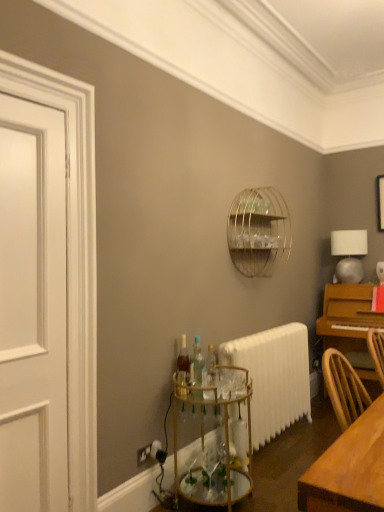
Describe the element at coordinates (183, 360) in the screenshot. The height and width of the screenshot is (512, 384). I see `translucent glass bottle at center, which is the first bottle from back to front` at that location.

This screenshot has width=384, height=512. I want to click on translucent glass bottle at center, the 2th bottle in the front-to-back sequence, so click(183, 360).

I want to click on white painted radiator at lower center, so click(x=273, y=377).

The width and height of the screenshot is (384, 512). Describe the element at coordinates (197, 362) in the screenshot. I see `clear glass bottles at center, acting as the 2th bottle starting from the back` at that location.

Locate an element on the screen. This screenshot has width=384, height=512. light brown wooden table at lower right is located at coordinates click(x=349, y=469).

From the image's perspective, which one is positioned lower, white painted wood door at left or white painted radiator at lower center?

white painted radiator at lower center.

Is white painted radiator at lower center at the back of white painted wood door at left?

No, white painted radiator at lower center is not at the back of white painted wood door at left.

From the picture: Is white painted wood door at left to the left of white painted radiator at lower center from the viewer's perspective?

Correct, you'll find white painted wood door at left to the left of white painted radiator at lower center.

Could you tell me if white painted radiator at lower center is facing clear glass bottles at center, which is the first bottle from front to back?

No, white painted radiator at lower center is not facing towards clear glass bottles at center, which is the first bottle from front to back.

Does white painted radiator at lower center lie behind clear glass bottles at center, acting as the 2th bottle starting from the back?

Yes, white painted radiator at lower center is further from the camera.

What's the angular difference between white painted radiator at lower center and clear glass bottles at center, acting as the 2th bottle starting from the back,'s facing directions?

21.3 degrees.

Considering the relative sizes of white painted radiator at lower center and clear glass bottles at center, acting as the 2th bottle starting from the back, in the image provided, is white painted radiator at lower center bigger than clear glass bottles at center, acting as the 2th bottle starting from the back,?

Yes, white painted radiator at lower center is bigger than clear glass bottles at center, acting as the 2th bottle starting from the back.

Consider the image. Which of these two, white matte table lamp at upper right or light brown wooden table at lower right, is wider?

Wider between the two is light brown wooden table at lower right.

Considering the sizes of objects white matte table lamp at upper right and light brown wooden table at lower right in the image provided, who is shorter, white matte table lamp at upper right or light brown wooden table at lower right?

With less height is light brown wooden table at lower right.

Is point (358, 281) positioned in front of point (365, 505)?

No.

Considering the relative positions of white matte table lamp at upper right and gold wire birdcage at upper center in the image provided, is white matte table lamp at upper right to the left of gold wire birdcage at upper center from the viewer's perspective?

No, white matte table lamp at upper right is not to the left of gold wire birdcage at upper center.

Is white matte table lamp at upper right spatially inside gold wire birdcage at upper center, or outside of it?

white matte table lamp at upper right lies outside gold wire birdcage at upper center.

Between white matte table lamp at upper right and gold wire birdcage at upper center, which one has smaller width?

white matte table lamp at upper right.

What's the angular difference between white painted wood door at left and white matte table lamp at upper right's facing directions?

The angular difference between white painted wood door at left and white matte table lamp at upper right is 52.9 degrees.

Which is further, (28, 221) or (352, 232)?

Point (352, 232)

Is white painted wood door at left to the left of white matte table lamp at upper right from the viewer's perspective?

Yes.

From the image's perspective, which is below, white painted wood door at left or white matte table lamp at upper right?

white painted wood door at left appears lower in the image.

Which of these two, gold wire birdcage at upper center or translucent glass bottle at center, which is the first bottle from back to front, is bigger?

Bigger between the two is gold wire birdcage at upper center.

Looking at this image, can you tell me how much gold wire birdcage at upper center and translucent glass bottle at center, the 2th bottle in the front-to-back sequence, differ in facing direction?

The angle between the facing direction of gold wire birdcage at upper center and the facing direction of translucent glass bottle at center, the 2th bottle in the front-to-back sequence, is 22.8 degrees.

Considering the relative positions of gold wire birdcage at upper center and translucent glass bottle at center, which is the first bottle from back to front, in the image provided, is gold wire birdcage at upper center to the left of translucent glass bottle at center, which is the first bottle from back to front, from the viewer's perspective?

No, gold wire birdcage at upper center is not to the left of translucent glass bottle at center, which is the first bottle from back to front.

From the image's perspective, is gold wire birdcage at upper center located above translucent glass bottle at center, which is the first bottle from back to front?

Yes, from the image's perspective, gold wire birdcage at upper center is over translucent glass bottle at center, which is the first bottle from back to front.

Is the position of clear glass bottles at center, which is the first bottle from front to back, more distant than that of white painted wood door at left?

Yes, clear glass bottles at center, which is the first bottle from front to back, is further from the viewer.

From a real-world perspective, is clear glass bottles at center, acting as the 2th bottle starting from the back, positioned above or below white painted wood door at left?

Clearly, from a real-world perspective, clear glass bottles at center, acting as the 2th bottle starting from the back, is below white painted wood door at left.

Consider the image. Considering the sizes of objects clear glass bottles at center, which is the first bottle from front to back, and white painted wood door at left in the image provided, who is bigger, clear glass bottles at center, which is the first bottle from front to back, or white painted wood door at left?

Bigger between the two is white painted wood door at left.

Is clear glass bottles at center, acting as the 2th bottle starting from the back, with white painted wood door at left?

clear glass bottles at center, acting as the 2th bottle starting from the back, and white painted wood door at left are clearly separated.

Find the location of `radiator below the white painted wood door at left (from a real-world perspective)`. radiator below the white painted wood door at left (from a real-world perspective) is located at coordinates (273, 377).

Locate an element on the screen. This screenshot has width=384, height=512. radiator on the right side of clear glass bottles at center, which is the first bottle from front to back is located at coordinates (273, 377).

When comparing their distances from white matte table lamp at upper right, does gold metallic bar cart at lower center or white painted radiator at lower center seem closer?

white painted radiator at lower center is closer to white matte table lamp at upper right.

Based on the photo, looking at the image, which one is located closer to gold metallic bar cart at lower center, white painted wood door at left or light brown wooden table at lower right?

Among the two, white painted wood door at left is located nearer to gold metallic bar cart at lower center.

When comparing their distances from translucent glass bottle at center, which is the first bottle from back to front, does gold metallic bar cart at lower center or gold wire birdcage at upper center seem closer?

gold metallic bar cart at lower center is closer to translucent glass bottle at center, which is the first bottle from back to front.

Estimate the real-world distances between objects in this image. Which object is further from clear glass bottles at center, acting as the 2th bottle starting from the back, white painted wood door at left or gold wire birdcage at upper center?

white painted wood door at left is positioned further to the anchor clear glass bottles at center, acting as the 2th bottle starting from the back.

Considering their positions, is gold metallic bar cart at lower center positioned closer to white matte table lamp at upper right than light brown wooden table at lower right?

gold metallic bar cart at lower center is closer to white matte table lamp at upper right.

Estimate the real-world distances between objects in this image. Which object is closer to gold metallic bar cart at lower center, clear glass bottles at center, acting as the 2th bottle starting from the back, or gold wire birdcage at upper center?

clear glass bottles at center, acting as the 2th bottle starting from the back, lies closer to gold metallic bar cart at lower center than the other object.

From the image, which object appears to be nearer to gold wire birdcage at upper center, clear glass bottles at center, acting as the 2th bottle starting from the back, or white matte table lamp at upper right?

Among the two, clear glass bottles at center, acting as the 2th bottle starting from the back, is located nearer to gold wire birdcage at upper center.

Which object lies nearer to the anchor point clear glass bottles at center, acting as the 2th bottle starting from the back, white painted radiator at lower center or light brown wooden table at lower right?

white painted radiator at lower center is closer to clear glass bottles at center, acting as the 2th bottle starting from the back.

The width and height of the screenshot is (384, 512). Identify the location of bottle between gold wire birdcage at upper center and translucent glass bottle at center, the 2th bottle in the front-to-back sequence, in the up-down direction. (197, 362).

Locate an element on the screen. This screenshot has height=512, width=384. glass table between translucent glass bottle at center, the 2th bottle in the front-to-back sequence, and white painted radiator at lower center from left to right is located at coordinates (219, 439).

In order to click on glass table located between light brown wooden table at lower right and translucent glass bottle at center, which is the first bottle from back to front, in the depth direction in this screenshot , I will do `click(219, 439)`.

Where is `bird cage between gold metallic bar cart at lower center and white matte table lamp at upper right along the z-axis`? The width and height of the screenshot is (384, 512). bird cage between gold metallic bar cart at lower center and white matte table lamp at upper right along the z-axis is located at coordinates (258, 231).